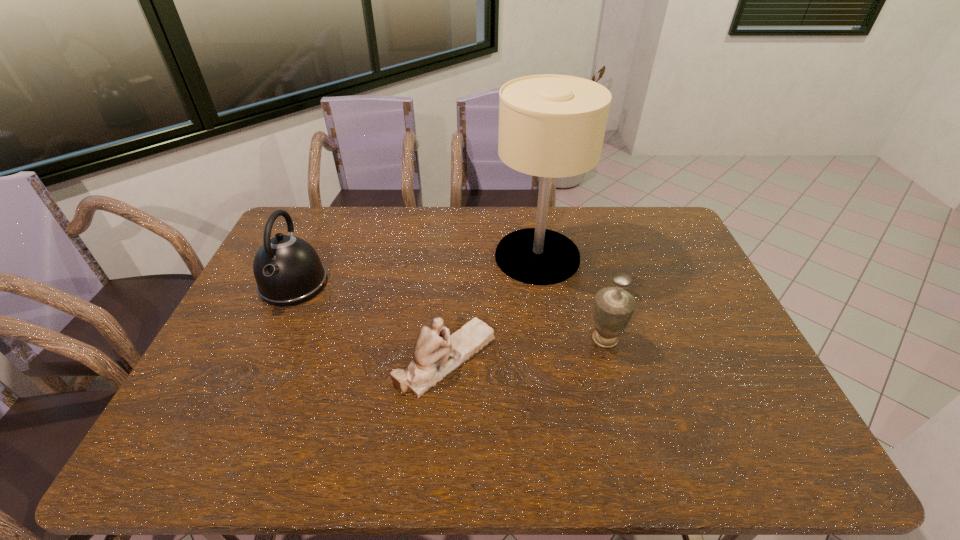
Locate an element on the screen. The height and width of the screenshot is (540, 960). free location that satisfies the following two spatial constraints: 1. on the spout of the kettle; 2. on the right side of the urn is located at coordinates (269, 339).

Identify the location of free space that satisfies the following two spatial constraints: 1. on the spout of the urn; 2. on the right side of the kettle. (269, 339).